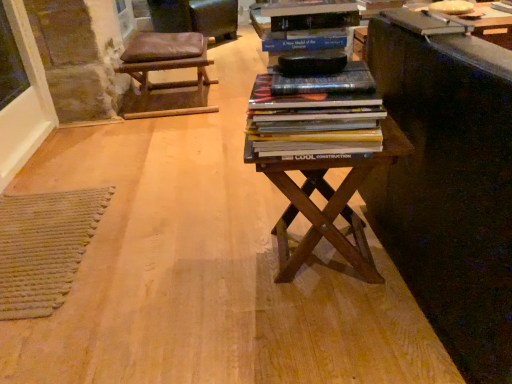
Find the location of `free space in front of brown leather stool at upper left`. free space in front of brown leather stool at upper left is located at coordinates (160, 134).